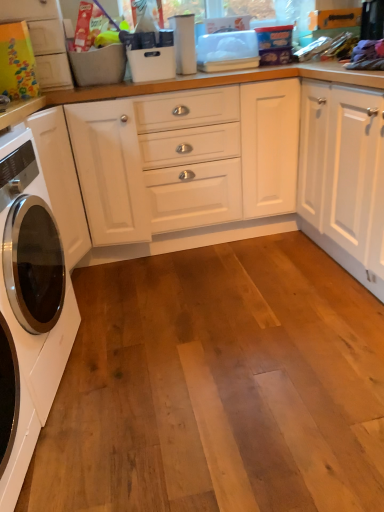
Question: Is matte cardboard box at upper left closer to camera compared to white glossy washing machine at left?

Choices:
 (A) yes
 (B) no

Answer: (B)

Question: Does matte cardboard box at upper left have a smaller size compared to white glossy washing machine at left?

Choices:
 (A) yes
 (B) no

Answer: (A)

Question: Is matte cardboard box at upper left positioned beyond the bounds of white glossy washing machine at left?

Choices:
 (A) yes
 (B) no

Answer: (A)

Question: Is matte cardboard box at upper left at the left side of white glossy washing machine at left?

Choices:
 (A) no
 (B) yes

Answer: (B)

Question: Could you tell me if matte cardboard box at upper left is turned towards white glossy washing machine at left?

Choices:
 (A) no
 (B) yes

Answer: (A)

Question: Considering the relative sizes of matte cardboard box at upper left and white glossy washing machine at left in the image provided, is matte cardboard box at upper left thinner than white glossy washing machine at left?

Choices:
 (A) yes
 (B) no

Answer: (A)

Question: Can you confirm if white glossy washing machine at left is thinner than matte cardboard box at upper left?

Choices:
 (A) no
 (B) yes

Answer: (A)

Question: Does white glossy washing machine at left appear on the left side of matte cardboard box at upper left?

Choices:
 (A) no
 (B) yes

Answer: (A)

Question: Is white glossy washing machine at left in front of matte cardboard box at upper left?

Choices:
 (A) yes
 (B) no

Answer: (A)

Question: From the image's perspective, is white glossy washing machine at left located above matte cardboard box at upper left?

Choices:
 (A) yes
 (B) no

Answer: (B)

Question: Is white glossy washing machine at left not close to matte cardboard box at upper left?

Choices:
 (A) no
 (B) yes

Answer: (A)

Question: Is white glossy washing machine at left in contact with matte cardboard box at upper left?

Choices:
 (A) yes
 (B) no

Answer: (B)

Question: Looking at their shapes, would you say matte cardboard box at upper left is wider or thinner than white glossy washing machine at left?

Choices:
 (A) thin
 (B) wide

Answer: (A)